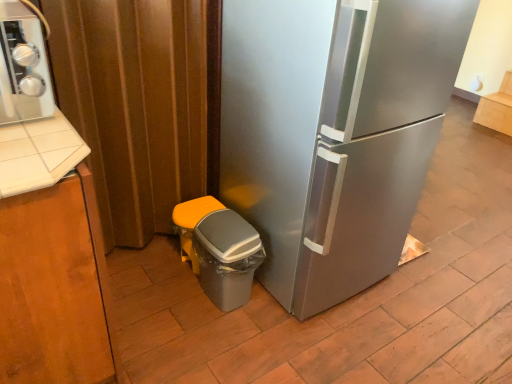
Question: From a real-world perspective, does matte wood cabinet at upper right, the second cabinetry when ordered from left to right, sit lower than gray plastic trash can at lower left?

Choices:
 (A) no
 (B) yes

Answer: (B)

Question: Is matte wood cabinet at upper right, the 1th cabinetry positioned from the right, closer to the viewer compared to gray plastic trash can at lower left?

Choices:
 (A) no
 (B) yes

Answer: (A)

Question: Would you say matte wood cabinet at upper right, placed as the first cabinetry when sorted from top to bottom, is outside gray plastic trash can at lower left?

Choices:
 (A) yes
 (B) no

Answer: (A)

Question: Is matte wood cabinet at upper right, the 1th cabinetry positioned from the right, smaller than gray plastic trash can at lower left?

Choices:
 (A) yes
 (B) no

Answer: (B)

Question: Can you confirm if matte wood cabinet at upper right, placed as the first cabinetry when sorted from top to bottom, is shorter than gray plastic trash can at lower left?

Choices:
 (A) yes
 (B) no

Answer: (A)

Question: In terms of height, does brushed metal stove at upper left look taller or shorter compared to stainless steel refrigerator at center?

Choices:
 (A) tall
 (B) short

Answer: (B)

Question: From the image's perspective, is brushed metal stove at upper left located above or below stainless steel refrigerator at center?

Choices:
 (A) above
 (B) below

Answer: (A)

Question: Looking at their shapes, would you say brushed metal stove at upper left is wider or thinner than stainless steel refrigerator at center?

Choices:
 (A) thin
 (B) wide

Answer: (A)

Question: Considering the positions of point (45, 97) and point (223, 72), is point (45, 97) closer or farther from the camera than point (223, 72)?

Choices:
 (A) closer
 (B) farther

Answer: (A)

Question: Visually, is matte brown curtain at left positioned to the left or to the right of stainless steel refrigerator at center?

Choices:
 (A) left
 (B) right

Answer: (A)

Question: From a real-world perspective, is matte brown curtain at left positioned above or below stainless steel refrigerator at center?

Choices:
 (A) above
 (B) below

Answer: (B)

Question: Does point (170, 99) appear closer or farther from the camera than point (451, 23)?

Choices:
 (A) closer
 (B) farther

Answer: (B)

Question: Is matte brown curtain at left inside or outside of stainless steel refrigerator at center?

Choices:
 (A) inside
 (B) outside

Answer: (B)

Question: In the image, is matte wood cabinet at upper right, the second cabinetry from the front, positioned in front of or behind gray plastic trash can at lower left?

Choices:
 (A) behind
 (B) front

Answer: (A)

Question: From the image's perspective, is matte wood cabinet at upper right, placed as the first cabinetry when sorted from top to bottom, located above or below gray plastic trash can at lower left?

Choices:
 (A) below
 (B) above

Answer: (B)